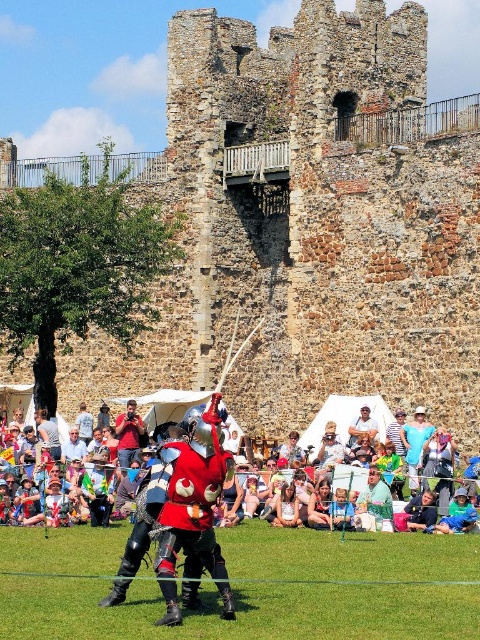
Question: Which object appears farthest from the camera in this image?

Choices:
 (A) brown stone castle at upper center
 (B) matte red armor at center

Answer: (A)

Question: Does brown stone castle at upper center have a lesser width compared to matte red armor at center?

Choices:
 (A) no
 (B) yes

Answer: (A)

Question: Does brown stone castle at upper center have a greater width compared to matte red armor at center?

Choices:
 (A) no
 (B) yes

Answer: (B)

Question: In this image, where is brown stone castle at upper center located relative to matte red armor at center?

Choices:
 (A) left
 (B) right

Answer: (B)

Question: Which of the following is the farthest from the observer?

Choices:
 (A) brown stone castle at upper center
 (B) matte red armor at center

Answer: (A)